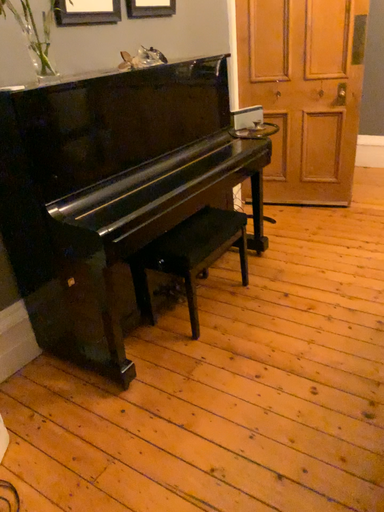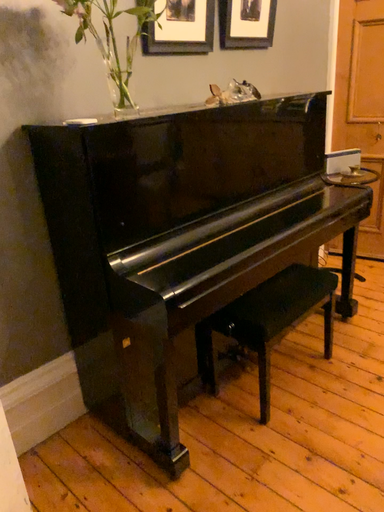
Question: Which way did the camera rotate in the video?

Choices:
 (A) rotated left
 (B) rotated right

Answer: (A)